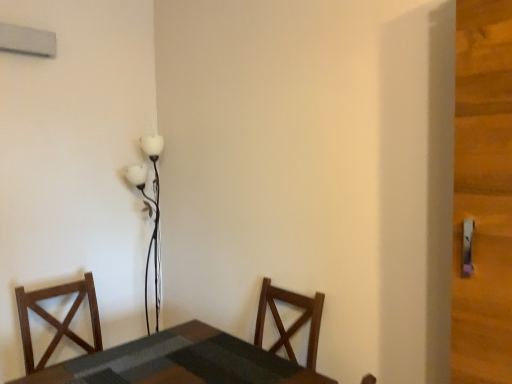
Question: Visually, is dark wood chair at left positioned to the left or to the right of smooth dark wood table at lower left?

Choices:
 (A) right
 (B) left

Answer: (B)

Question: Looking at the image, does dark wood chair at left seem bigger or smaller compared to smooth dark wood table at lower left?

Choices:
 (A) big
 (B) small

Answer: (B)

Question: Which object is positioned closest to the dark wood chair at left?

Choices:
 (A) white glossy floor lamp at upper center
 (B) smooth dark wood table at lower left

Answer: (B)

Question: Based on their relative distances, which object is nearer to the white glossy floor lamp at upper center?

Choices:
 (A) smooth dark wood table at lower left
 (B) dark wood chair at left

Answer: (B)